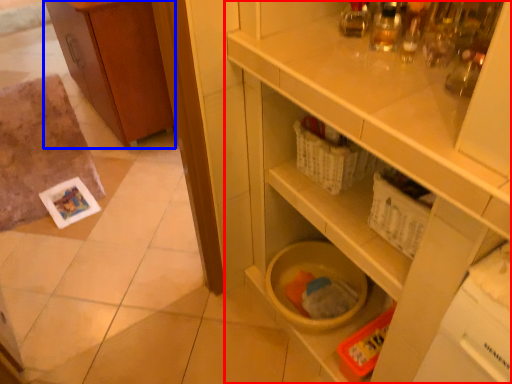
Question: Which of the following is the farthest to the observer, cupboard (highlighted by a red box) or cabinetry (highlighted by a blue box)?

Choices:
 (A) cupboard
 (B) cabinetry

Answer: (B)